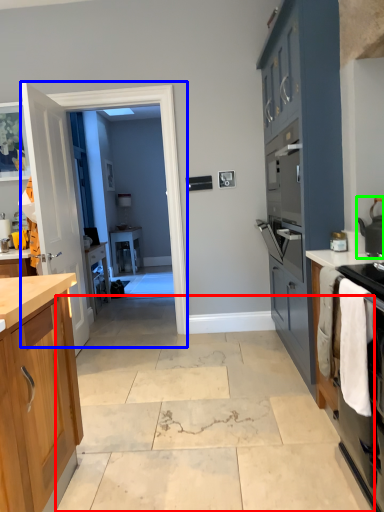
Question: Based on their relative distances, which object is farther from concrete (highlighted by a red box)? Choose from glass door (highlighted by a blue box) and kitchen appliance (highlighted by a green box).

Choices:
 (A) glass door
 (B) kitchen appliance

Answer: (B)